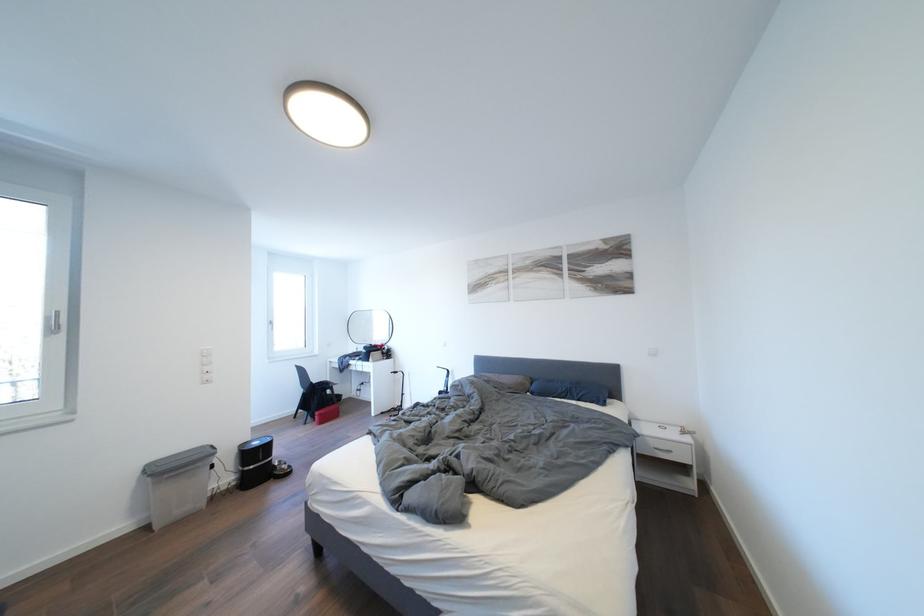
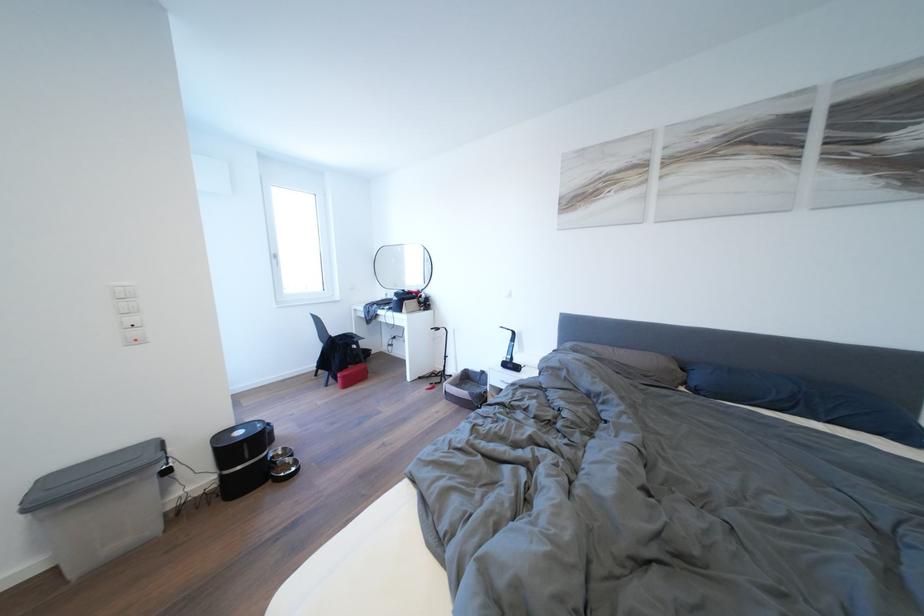
Locate, in the second image, the point that corresponds to [280,328] in the first image.

(284, 261)